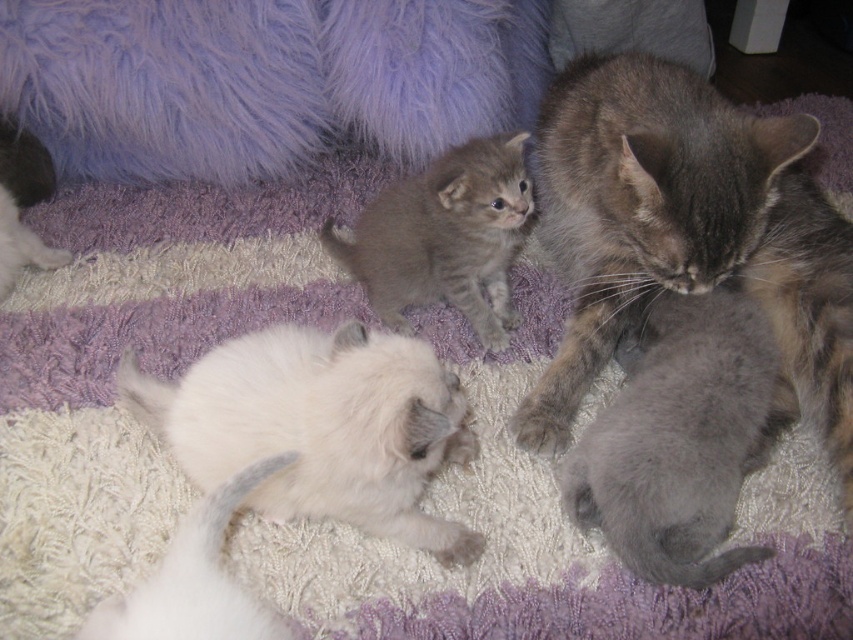
Measure the distance between point (439, 268) and camera.

A distance of 4.01 feet exists between point (439, 268) and camera.

Image resolution: width=853 pixels, height=640 pixels. Find the location of `gray fluffy kitten at center`. gray fluffy kitten at center is located at coordinates (445, 236).

Is point (471, 195) closer to viewer compared to point (248, 627)?

No, (471, 195) is further to viewer.

Find the location of `gray fluffy kitten at center`. gray fluffy kitten at center is located at coordinates (445, 236).

Can you confirm if gray fluffy cat at lower right is taller than soft gray kitten at lower right?

Yes, gray fluffy cat at lower right is taller than soft gray kitten at lower right.

Can you confirm if gray fluffy cat at lower right is wider than soft gray kitten at lower right?

Yes.

This screenshot has width=853, height=640. In order to click on gray fluffy cat at lower right in this screenshot , I will do `click(686, 234)`.

Does soft gray kitten at lower right have a lesser height compared to white fur cat at upper left?

Indeed, soft gray kitten at lower right has a lesser height compared to white fur cat at upper left.

The image size is (853, 640). Find the location of `soft gray kitten at lower right`. soft gray kitten at lower right is located at coordinates (677, 438).